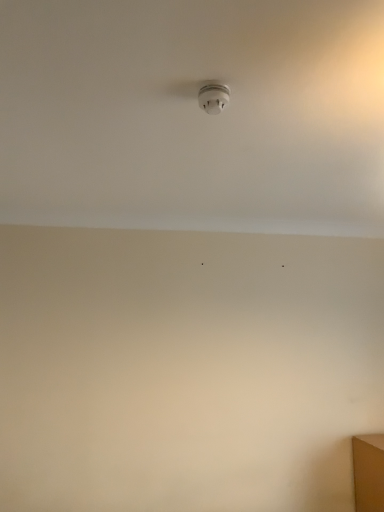
What do you see at coordinates (213, 97) in the screenshot? The width and height of the screenshot is (384, 512). I see `white plastic smoke detector at upper center` at bounding box center [213, 97].

Where is `white plastic smoke detector at upper center`? This screenshot has height=512, width=384. white plastic smoke detector at upper center is located at coordinates (213, 97).

Measure the distance between white plastic smoke detector at upper center and camera.

The depth of white plastic smoke detector at upper center is 1.30 meters.

What do you see at coordinates (193, 115) in the screenshot? The height and width of the screenshot is (512, 384). I see `white matte ceiling at center` at bounding box center [193, 115].

Measure the distance between white matte ceiling at center and camera.

white matte ceiling at center is 38.95 inches away from camera.

You are a GUI agent. You are given a task and a screenshot of the screen. Output one action in this format:
    pyautogui.click(x=<x>, y=<y>)
    Task: Click on the white matte ceiling at center
    Image resolution: width=384 pixels, height=512 pixels.
    Given the screenshot: What is the action you would take?
    pyautogui.click(x=193, y=115)

Identify the location of white plastic smoke detector at upper center. (213, 97).

Visually, is white matte ceiling at center positioned to the left or to the right of white plastic smoke detector at upper center?

Based on their positions, white matte ceiling at center is located to the right of white plastic smoke detector at upper center.

Relative to white plastic smoke detector at upper center, is white matte ceiling at center in front or behind?

Visually, white matte ceiling at center is located in front of white plastic smoke detector at upper center.

Does point (244, 151) lie behind point (216, 87)?

That is True.

From the image's perspective, is white matte ceiling at center positioned above or below white plastic smoke detector at upper center?

Based on their image positions, white matte ceiling at center is located beneath white plastic smoke detector at upper center.

From a real-world perspective, which object rests below the other?

white plastic smoke detector at upper center, from a real-world perspective.

Is white matte ceiling at center wider or thinner than white plastic smoke detector at upper center?

white matte ceiling at center is wider than white plastic smoke detector at upper center.

Is white matte ceiling at center taller than white plastic smoke detector at upper center?

Yes.

Considering the relative sizes of white matte ceiling at center and white plastic smoke detector at upper center in the image provided, is white matte ceiling at center bigger than white plastic smoke detector at upper center?

Indeed, white matte ceiling at center has a larger size compared to white plastic smoke detector at upper center.

Is white matte ceiling at center outside of white plastic smoke detector at upper center?

white matte ceiling at center is positioned outside white plastic smoke detector at upper center.

Is there a large distance between white matte ceiling at center and white plastic smoke detector at upper center?

That's not correct — white matte ceiling at center is a little close to white plastic smoke detector at upper center.

Is white matte ceiling at center positioned with its back to white plastic smoke detector at upper center?

No, white matte ceiling at center is not facing the opposite direction of white plastic smoke detector at upper center.

What's the angular difference between white matte ceiling at center and white plastic smoke detector at upper center's facing directions?

white matte ceiling at center and white plastic smoke detector at upper center are facing 92.9 degrees away from each other.

This screenshot has width=384, height=512. I want to click on light fixture located on the left of white matte ceiling at center, so click(213, 97).

Which is more to the right, white plastic smoke detector at upper center or white matte ceiling at center?

white matte ceiling at center is more to the right.

Looking at this image, which object is more forward, white plastic smoke detector at upper center or white matte ceiling at center?

white matte ceiling at center is in front.

Which is less distant, (216,97) or (247,59)?

The point (247,59) is closer.

From the image's perspective, which one is positioned higher, white plastic smoke detector at upper center or white matte ceiling at center?

white plastic smoke detector at upper center, from the image's perspective.

From a real-world perspective, does white plastic smoke detector at upper center sit lower than white matte ceiling at center?

Yes, from a real-world perspective, white plastic smoke detector at upper center is beneath white matte ceiling at center.

Can you confirm if white plastic smoke detector at upper center is thinner than white matte ceiling at center?

Yes.

Can you confirm if white plastic smoke detector at upper center is shorter than white matte ceiling at center?

Indeed, white plastic smoke detector at upper center has a lesser height compared to white matte ceiling at center.

Can you confirm if white plastic smoke detector at upper center is bigger than white matte ceiling at center?

No.

Which is correct: white plastic smoke detector at upper center is inside white matte ceiling at center, or outside of it?

white plastic smoke detector at upper center is enclosed within white matte ceiling at center.

Is white plastic smoke detector at upper center touching white matte ceiling at center?

white plastic smoke detector at upper center and white matte ceiling at center are not in contact.

Is white plastic smoke detector at upper center turned away from white matte ceiling at center?

No.

Measure the distance between white plastic smoke detector at upper center and white matte ceiling at center.

19.14 inches.

At what (x,y) coordinates should I click in order to perform the action: click on backdrop in front of the white plastic smoke detector at upper center. Please return your answer as a coordinate pair (x, y). Image resolution: width=384 pixels, height=512 pixels. Looking at the image, I should click on (193, 115).

Find the location of a particular element. backdrop in front of the white plastic smoke detector at upper center is located at coordinates (193, 115).

Where is `light fixture lying behind the white matte ceiling at center`? light fixture lying behind the white matte ceiling at center is located at coordinates (213, 97).